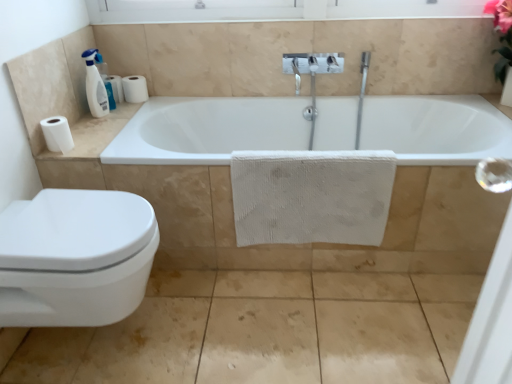
Question: Would you consider white glossy bathtub at center to be distant from matte beige tile at lower left?

Choices:
 (A) no
 (B) yes

Answer: (A)

Question: Does white glossy bathtub at center have a smaller size compared to matte beige tile at lower left?

Choices:
 (A) yes
 (B) no

Answer: (B)

Question: Considering the relative sizes of white glossy bathtub at center and matte beige tile at lower left in the image provided, is white glossy bathtub at center bigger than matte beige tile at lower left?

Choices:
 (A) no
 (B) yes

Answer: (B)

Question: Is white glossy bathtub at center to the right of matte beige tile at lower left from the viewer's perspective?

Choices:
 (A) yes
 (B) no

Answer: (A)

Question: From a real-world perspective, is white glossy bathtub at center under matte beige tile at lower left?

Choices:
 (A) yes
 (B) no

Answer: (B)

Question: From the image's perspective, is white glossy bathtub at center above or below white matte paper towel at left?

Choices:
 (A) below
 (B) above

Answer: (A)

Question: From a real-world perspective, is white glossy bathtub at center positioned above or below white matte paper towel at left?

Choices:
 (A) below
 (B) above

Answer: (A)

Question: Considering the positions of white glossy bathtub at center and white matte paper towel at left in the image, is white glossy bathtub at center taller or shorter than white matte paper towel at left?

Choices:
 (A) tall
 (B) short

Answer: (A)

Question: Is point (110, 163) closer or farther from the camera than point (80, 125)?

Choices:
 (A) farther
 (B) closer

Answer: (B)

Question: Looking at their shapes, would you say white plastic bottle at upper left is wider or thinner than white matte paper towel at left?

Choices:
 (A) thin
 (B) wide

Answer: (A)

Question: Is point (90, 105) positioned closer to the camera than point (89, 157)?

Choices:
 (A) farther
 (B) closer

Answer: (A)

Question: From the image's perspective, relative to white matte paper towel at left, is white plastic bottle at upper left above or below?

Choices:
 (A) below
 (B) above

Answer: (B)

Question: In terms of size, does white plastic bottle at upper left appear bigger or smaller than white matte paper towel at left?

Choices:
 (A) small
 (B) big

Answer: (A)

Question: Is white glossy toilet at lower left inside the boundaries of white textured towel at center, or outside?

Choices:
 (A) inside
 (B) outside

Answer: (B)

Question: Is white glossy toilet at lower left in front of or behind white textured towel at center in the image?

Choices:
 (A) front
 (B) behind

Answer: (A)